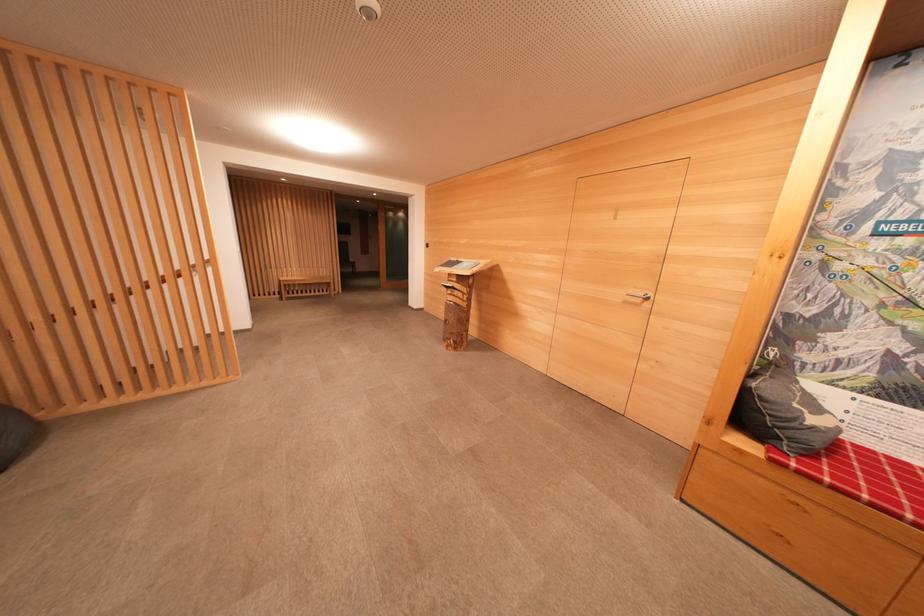
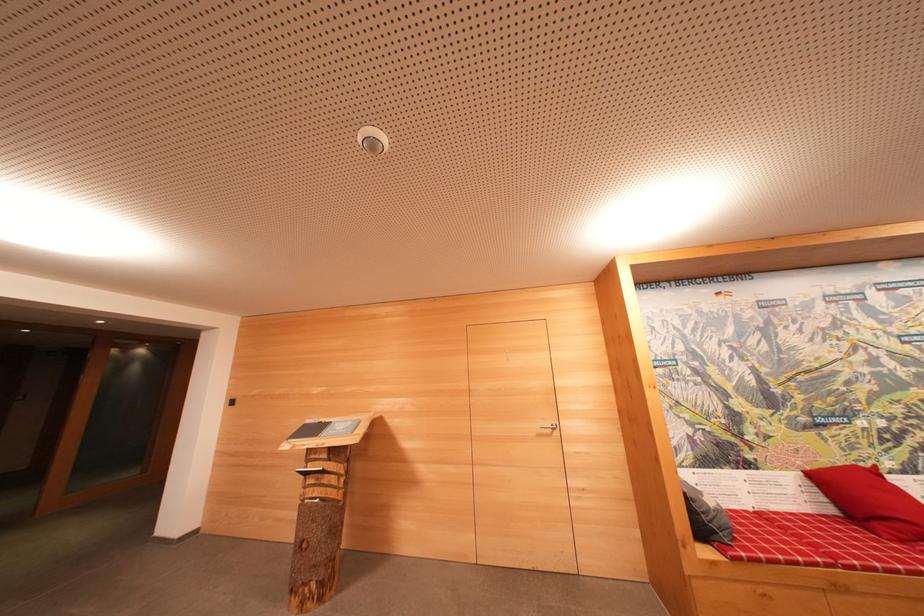
The first image is from the beginning of the video and the second image is from the end. How did the camera likely rotate when shooting the video?

The rotation direction of the camera is right-up.